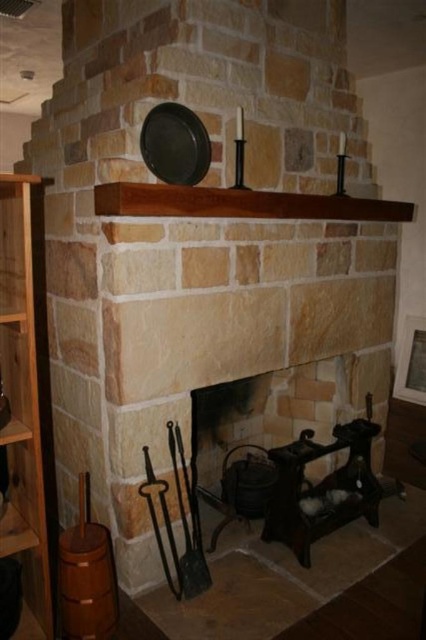
Who is more forward, (235, 504) or (40, 244)?

Point (40, 244)

Who is more distant from viewer, (328,525) or (2,179)?

Positioned behind is point (328,525).

Image resolution: width=426 pixels, height=640 pixels. In order to click on dark brown wood fireplace at center in this screenshot , I will do `click(282, 451)`.

Can you confirm if brown wooden bookshelf at left is shorter than black metal shovel at lower center?

No.

Where is `brown wooden bookshelf at left`? This screenshot has width=426, height=640. brown wooden bookshelf at left is located at coordinates point(25,387).

The image size is (426, 640). I want to click on brown wooden bookshelf at left, so click(x=25, y=387).

Which of these two, dark brown wood fireplace at center or black metal shovel at lower center, stands taller?

With more height is dark brown wood fireplace at center.

This screenshot has width=426, height=640. What do you see at coordinates (282, 451) in the screenshot? I see `dark brown wood fireplace at center` at bounding box center [282, 451].

Identify the location of dark brown wood fireplace at center. The image size is (426, 640). (282, 451).